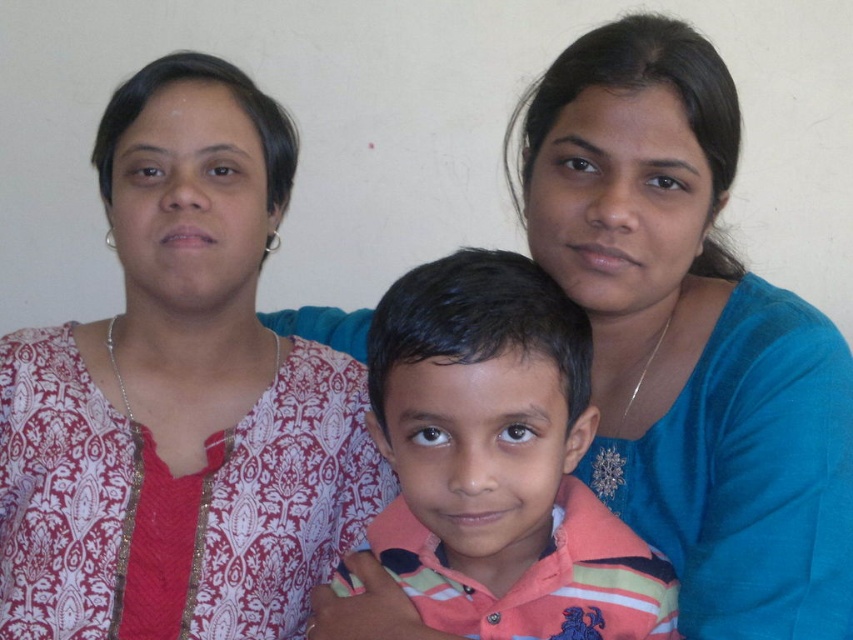
Question: Which point is closer to the camera taking this photo?

Choices:
 (A) (753, 340)
 (B) (244, 356)
 (C) (434, 588)

Answer: (C)

Question: Which point is farther from the camera taking this photo?

Choices:
 (A) (135, 323)
 (B) (677, 115)
 (C) (438, 474)

Answer: (A)

Question: Based on their relative distances, which object is nearer to the striped cotton shirt at center?

Choices:
 (A) patterned fabric shirt at left
 (B) blue fabric at upper right

Answer: (B)

Question: Is blue fabric at upper right further to camera compared to striped cotton shirt at center?

Choices:
 (A) yes
 (B) no

Answer: (A)

Question: Is patterned fabric shirt at left below striped cotton shirt at center?

Choices:
 (A) no
 (B) yes

Answer: (A)

Question: Is patterned fabric shirt at left positioned before striped cotton shirt at center?

Choices:
 (A) yes
 (B) no

Answer: (B)